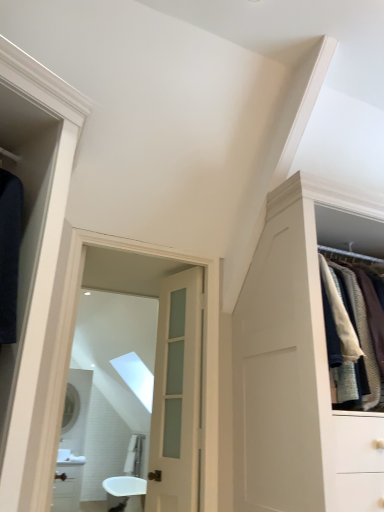
What do you see at coordinates (125, 493) in the screenshot? This screenshot has height=512, width=384. I see `white glossy sink at center` at bounding box center [125, 493].

In order to face clear glass mirror at center, acting as the 2th mirror starting from the back, should I rotate leftwards or rightwards?

Turn left approximately 6.074 degrees to face it.

Describe the element at coordinates (70, 408) in the screenshot. This screenshot has width=384, height=512. I see `matte silver mirror at center, positioned as the 2th mirror in front-to-back order` at that location.

This screenshot has width=384, height=512. What are the coordinates of `white glossy sink at center` in the screenshot? It's located at (125, 493).

Which of these two, clear glass mirror at center, positioned as the 1th mirror in right-to-left order, or matte silver mirror at center, placed as the 1th mirror when sorted from left to right, stands shorter?

matte silver mirror at center, placed as the 1th mirror when sorted from left to right.

Based on the photo, from the image's perspective, which object appears higher, clear glass mirror at center, which appears as the first mirror when viewed from the top, or matte silver mirror at center, positioned as the 2th mirror in front-to-back order?

clear glass mirror at center, which appears as the first mirror when viewed from the top, appears higher in the image.

Between clear glass mirror at center, positioned as the 1th mirror in right-to-left order, and matte silver mirror at center, positioned as the 2th mirror in front-to-back order, which one appears on the left side from the viewer's perspective?

matte silver mirror at center, positioned as the 2th mirror in front-to-back order.

Is point (116, 341) closer or farther from the camera than point (67, 414)?

Point (116, 341).

Is clear glass mirror at center, positioned as the 2th mirror in bottom-to-top order, surrounding satin white door at center?

No, satin white door at center is not surrounded by clear glass mirror at center, positioned as the 2th mirror in bottom-to-top order.

Who is shorter, clear glass mirror at center, the 2th mirror in the left-to-right sequence, or satin white door at center?

clear glass mirror at center, the 2th mirror in the left-to-right sequence.

From a real-world perspective, which mirror is the 2nd one above the satin white door at center? Please provide its 2D coordinates.

[(116, 334)]

Consider the image. From the image's perspective, is satin white door at center under clear glass mirror at center, acting as the 2th mirror starting from the back?

Yes.

From a real-world perspective, which object rests below the other?

In real-world perspective, satin white door at center is lower.

Is point (169, 306) positioned after point (146, 260)?

That is True.

Is satin white door at center taller than clear glass mirror at center, acting as the 2th mirror starting from the back?

Yes, satin white door at center is taller than clear glass mirror at center, acting as the 2th mirror starting from the back.

Considering the sizes of objects white glossy sink at center and satin white door at center in the image provided, who is thinner, white glossy sink at center or satin white door at center?

Thinner between the two is satin white door at center.

In terms of height, does white glossy sink at center look taller or shorter compared to satin white door at center?

Considering their sizes, white glossy sink at center has less height than satin white door at center.

This screenshot has width=384, height=512. In order to click on door above the white glossy sink at center (from a real-world perspective) in this screenshot , I will do `click(176, 396)`.

Does white glossy sink at center contain satin white door at center?

Definitely not — satin white door at center is not inside white glossy sink at center.

Is matte silver mirror at center, the 2th mirror viewed from the top, beside clear glass mirror at center, the 2th mirror in the left-to-right sequence?

No, matte silver mirror at center, the 2th mirror viewed from the top, is not touching clear glass mirror at center, the 2th mirror in the left-to-right sequence.

In the scene shown: In terms of width, does matte silver mirror at center, the first mirror positioned from the bottom, look wider or thinner when compared to clear glass mirror at center, positioned as the 1th mirror in right-to-left order?

matte silver mirror at center, the first mirror positioned from the bottom, is thinner than clear glass mirror at center, positioned as the 1th mirror in right-to-left order.

Is matte silver mirror at center, the second mirror when ordered from right to left, positioned behind clear glass mirror at center, positioned as the 1th mirror in front-to-back order?

Yes, it is.

Between point (66, 408) and point (147, 290), which one is positioned behind?

The point (147, 290) is more distant.

Which is less distant, (182, 398) or (134, 496)?

The point (182, 398) is more forward.

Consider the image. Does satin white door at center turn towards white glossy sink at center?

Answer: No.

Based on the photo, does satin white door at center lie in front of white glossy sink at center?

Yes, it is.

Is satin white door at center shorter than white glossy sink at center?

Incorrect, the height of satin white door at center does not fall short of that of white glossy sink at center.

From the image's perspective, does matte silver mirror at center, the first mirror positioned from the bottom, appear higher than white glossy sink at center?

Yes, from the image's perspective, matte silver mirror at center, the first mirror positioned from the bottom, is over white glossy sink at center.

From a real-world perspective, who is located higher, matte silver mirror at center, placed as the 1th mirror when sorted from left to right, or white glossy sink at center?

In real-world perspective, matte silver mirror at center, placed as the 1th mirror when sorted from left to right, is above.

Is matte silver mirror at center, placed as the 1th mirror when sorted from left to right, positioned in front of white glossy sink at center?

No.

You are a GUI agent. You are given a task and a screenshot of the screen. Output one action in this format:
    pyautogui.click(x=<x>, y=<y>)
    Task: Click on the mirror on the left side of clear glass mirror at center, positioned as the 1th mirror in right-to-left order
    The height and width of the screenshot is (512, 384).
    Given the screenshot: What is the action you would take?
    pyautogui.click(x=70, y=408)

You are a GUI agent. You are given a task and a screenshot of the screen. Output one action in this format:
    pyautogui.click(x=<x>, y=<y>)
    Task: Click on the door on the right of the clear glass mirror at center, acting as the 2th mirror starting from the back
    This screenshot has width=384, height=512.
    Given the screenshot: What is the action you would take?
    pyautogui.click(x=176, y=396)

Considering their positions, is white glossy sink at center positioned further to matte silver mirror at center, placed as the 1th mirror when sorted from left to right, than satin white door at center?

white glossy sink at center is positioned further to the anchor matte silver mirror at center, placed as the 1th mirror when sorted from left to right.

When comparing their distances from matte silver mirror at center, the first mirror positioned from the back, does satin white door at center or clear glass mirror at center, positioned as the 2th mirror in bottom-to-top order, seem closer?

satin white door at center lies closer to matte silver mirror at center, the first mirror positioned from the back, than the other object.

From the image, which object appears to be nearer to white glossy sink at center, clear glass mirror at center, which appears as the first mirror when viewed from the top, or matte silver mirror at center, the second mirror when ordered from right to left?

Based on the image, clear glass mirror at center, which appears as the first mirror when viewed from the top, appears to be nearer to white glossy sink at center.

Considering their positions, is satin white door at center positioned further to white glossy sink at center than matte silver mirror at center, the first mirror positioned from the back?

Among the two, satin white door at center is located further to white glossy sink at center.

Based on their spatial positions, is matte silver mirror at center, positioned as the 2th mirror in front-to-back order, or clear glass mirror at center, the 2th mirror in the left-to-right sequence, closer to satin white door at center?

clear glass mirror at center, the 2th mirror in the left-to-right sequence, is closer to satin white door at center.

From the image, which object appears to be farther from clear glass mirror at center, which appears as the first mirror when viewed from the top, white glossy sink at center or satin white door at center?

white glossy sink at center is further to clear glass mirror at center, which appears as the first mirror when viewed from the top.

Based on their spatial positions, is clear glass mirror at center, positioned as the 2th mirror in bottom-to-top order, or matte silver mirror at center, the second mirror when ordered from right to left, closer to satin white door at center?

The object closer to satin white door at center is clear glass mirror at center, positioned as the 2th mirror in bottom-to-top order.

Looking at the image, which one is located closer to matte silver mirror at center, the first mirror positioned from the bottom, clear glass mirror at center, acting as the 2th mirror starting from the back, or satin white door at center?

satin white door at center.

Locate an element on the screen. bath located between clear glass mirror at center, which appears as the first mirror when viewed from the top, and matte silver mirror at center, positioned as the 2th mirror in front-to-back order, in the depth direction is located at coordinates (125, 493).

You are a GUI agent. You are given a task and a screenshot of the screen. Output one action in this format:
    pyautogui.click(x=<x>, y=<y>)
    Task: Click on the door between clear glass mirror at center, which appears as the first mirror when viewed from the top, and white glossy sink at center from front to back
    The height and width of the screenshot is (512, 384).
    Given the screenshot: What is the action you would take?
    pyautogui.click(x=176, y=396)

Identify the location of bath between satin white door at center and matte silver mirror at center, the first mirror positioned from the back, from front to back. The image size is (384, 512). (125, 493).

You are a GUI agent. You are given a task and a screenshot of the screen. Output one action in this format:
    pyautogui.click(x=<x>, y=<y>)
    Task: Click on the door between clear glass mirror at center, acting as the 2th mirror starting from the back, and matte silver mirror at center, placed as the 1th mirror when sorted from left to right, from front to back
    The image size is (384, 512).
    Given the screenshot: What is the action you would take?
    pyautogui.click(x=176, y=396)